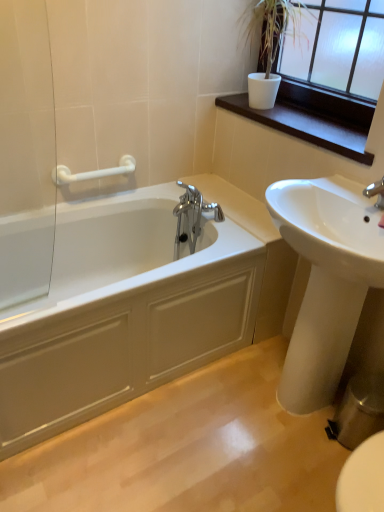
Image resolution: width=384 pixels, height=512 pixels. In order to click on dark brown wood at upper right in this screenshot , I will do `click(340, 47)`.

Image resolution: width=384 pixels, height=512 pixels. What do you see at coordinates (122, 313) in the screenshot?
I see `white glossy bathtub at left` at bounding box center [122, 313].

This screenshot has height=512, width=384. What do you see at coordinates (93, 172) in the screenshot? I see `white plastic grab bar at upper left` at bounding box center [93, 172].

What is the approximate height of dark wood window sill at upper right?

The height of dark wood window sill at upper right is 1.97 inches.

Identify the location of white glossy sink at lower right. The height and width of the screenshot is (512, 384). (325, 280).

You are a GUI agent. You are given a task and a screenshot of the screen. Output one action in this format:
    pyautogui.click(x=<x>, y=<y>)
    Task: Click on the dark brown wood at upper right
    Image resolution: width=384 pixels, height=512 pixels.
    Given the screenshot: What is the action you would take?
    pyautogui.click(x=340, y=47)

From the image's perspective, is white glossy bathtub at left over dark brown wood at upper right?

No.

Which of these two, white glossy bathtub at left or dark brown wood at upper right, is wider?

white glossy bathtub at left is wider.

Which is more distant, (100, 208) or (376, 25)?

Point (100, 208)

Who is shorter, white glossy bathtub at left or dark brown wood at upper right?

dark brown wood at upper right.

Does white glossy sink at lower right appear on the right side of white glossy bathtub at left?

Indeed, white glossy sink at lower right is positioned on the right side of white glossy bathtub at left.

From a real-world perspective, does white glossy sink at lower right sit lower than white glossy bathtub at left?

No, from a real-world perspective, white glossy sink at lower right is not under white glossy bathtub at left.

How much distance is there between white glossy sink at lower right and white glossy bathtub at left?

white glossy sink at lower right is 18.32 inches away from white glossy bathtub at left.

Looking at this image, is white glossy sink at lower right positioned beyond the bounds of white glossy bathtub at left?

Yes, white glossy sink at lower right is not within white glossy bathtub at left.

Identify the location of window sill that appears above the white glossy bathtub at left (from the image's perspective). Image resolution: width=384 pixels, height=512 pixels. (313, 118).

Is white glossy bathtub at left positioned with its back to dark wood window sill at upper right?

That's not correct — white glossy bathtub at left is not looking away from dark wood window sill at upper right.

Considering the sizes of white glossy bathtub at left and dark wood window sill at upper right in the image, is white glossy bathtub at left wider or thinner than dark wood window sill at upper right?

Considering their sizes, white glossy bathtub at left looks broader than dark wood window sill at upper right.

Is there a large distance between white glossy bathtub at left and dark wood window sill at upper right?

No, white glossy bathtub at left is in close proximity to dark wood window sill at upper right.

Considering the sizes of dark brown wood at upper right and white glossy bathtub at left in the image, is dark brown wood at upper right wider or thinner than white glossy bathtub at left?

In the image, dark brown wood at upper right appears to be more narrow than white glossy bathtub at left.

Considering the positions of objects dark brown wood at upper right and white glossy bathtub at left in the image provided, who is more to the right, dark brown wood at upper right or white glossy bathtub at left?

From the viewer's perspective, dark brown wood at upper right appears more on the right side.

Is dark brown wood at upper right placed right next to white glossy bathtub at left?

dark brown wood at upper right is not next to white glossy bathtub at left, and they're not touching.

Considering the relative sizes of white glossy sink at lower right and dark brown wood at upper right in the image provided, is white glossy sink at lower right taller than dark brown wood at upper right?

Indeed, white glossy sink at lower right has a greater height compared to dark brown wood at upper right.

Does white glossy sink at lower right lie in front of dark brown wood at upper right?

Yes, white glossy sink at lower right is closer to the viewer.

Can dark brown wood at upper right be found inside white glossy sink at lower right?

No.

Find the location of a particular element. This screenshot has height=512, width=384. bathtub located underneath the white plastic grab bar at upper left (from a real-world perspective) is located at coordinates (122, 313).

From a real-world perspective, who is located higher, white glossy bathtub at left or white plastic grab bar at upper left?

white plastic grab bar at upper left, from a real-world perspective.

Considering the positions of objects white glossy bathtub at left and white plastic grab bar at upper left in the image provided, who is more to the right, white glossy bathtub at left or white plastic grab bar at upper left?

white glossy bathtub at left.

Can you confirm if white glossy bathtub at left is taller than white plastic grab bar at upper left?

Indeed, white glossy bathtub at left has a greater height compared to white plastic grab bar at upper left.

Considering the positions of objects dark wood window sill at upper right and white glossy bathtub at left in the image provided, who is more to the right, dark wood window sill at upper right or white glossy bathtub at left?

dark wood window sill at upper right is more to the right.

Is dark wood window sill at upper right completely or partially outside of white glossy bathtub at left?

That's correct, dark wood window sill at upper right is outside of white glossy bathtub at left.

The image size is (384, 512). There is a white glossy bathtub at left. In order to click on window sill above it (from a real-world perspective) in this screenshot , I will do `click(313, 118)`.

From the image's perspective, which object appears higher, dark wood window sill at upper right or white glossy bathtub at left?

dark wood window sill at upper right appears higher in the image.

Find the location of a particular element. The width and height of the screenshot is (384, 512). window frame above the white glossy bathtub at left (from the image's perspective) is located at coordinates (340, 47).

This screenshot has height=512, width=384. I want to click on bathtub behind the white glossy sink at lower right, so click(122, 313).

Based on the photo, estimate the real-world distances between objects in this image. Which object is closer to dark brown wood at upper right, white glossy bathtub at left or white plastic grab bar at upper left?

Based on the image, white plastic grab bar at upper left appears to be nearer to dark brown wood at upper right.

Looking at the image, which one is located further to dark brown wood at upper right, dark wood window sill at upper right or white glossy bathtub at left?

white glossy bathtub at left is positioned further to the anchor dark brown wood at upper right.

When comparing their distances from white plastic grab bar at upper left, does dark wood window sill at upper right or white glossy sink at lower right seem closer?

Among the two, dark wood window sill at upper right is located nearer to white plastic grab bar at upper left.

Looking at the image, which one is located closer to white glossy sink at lower right, dark wood window sill at upper right or dark brown wood at upper right?

dark wood window sill at upper right is closer to white glossy sink at lower right.

From the image, which object appears to be nearer to white plastic grab bar at upper left, white glossy sink at lower right or white glossy bathtub at left?

white glossy bathtub at left lies closer to white plastic grab bar at upper left than the other object.

From the picture: When comparing their distances from white glossy bathtub at left, does white plastic grab bar at upper left or white glossy sink at lower right seem further?

white plastic grab bar at upper left is further to white glossy bathtub at left.

Estimate the real-world distances between objects in this image. Which object is further from white glossy sink at lower right, dark brown wood at upper right or dark wood window sill at upper right?

dark brown wood at upper right.

Which object lies nearer to the anchor point white plastic grab bar at upper left, white glossy sink at lower right or dark brown wood at upper right?

dark brown wood at upper right lies closer to white plastic grab bar at upper left than the other object.

Locate an element on the screen. This screenshot has width=384, height=512. bathtub situated between white plastic grab bar at upper left and dark wood window sill at upper right from left to right is located at coordinates (122, 313).

This screenshot has height=512, width=384. Identify the location of window sill that lies between dark brown wood at upper right and white glossy sink at lower right from top to bottom. (313, 118).

You are a GUI agent. You are given a task and a screenshot of the screen. Output one action in this format:
    pyautogui.click(x=<x>, y=<y>)
    Task: Click on the bathtub between white plastic grab bar at upper left and dark brown wood at upper right from left to right
    Image resolution: width=384 pixels, height=512 pixels.
    Given the screenshot: What is the action you would take?
    pyautogui.click(x=122, y=313)

Image resolution: width=384 pixels, height=512 pixels. Identify the location of bathtub situated between white plastic grab bar at upper left and white glossy sink at lower right from left to right. (122, 313).